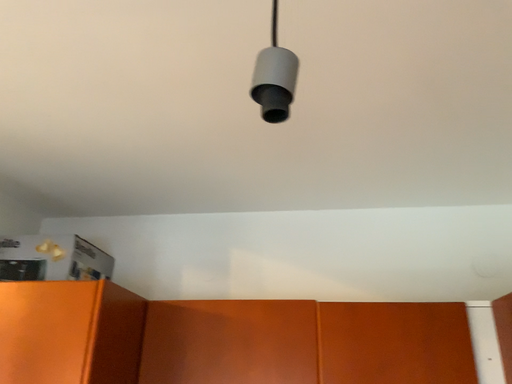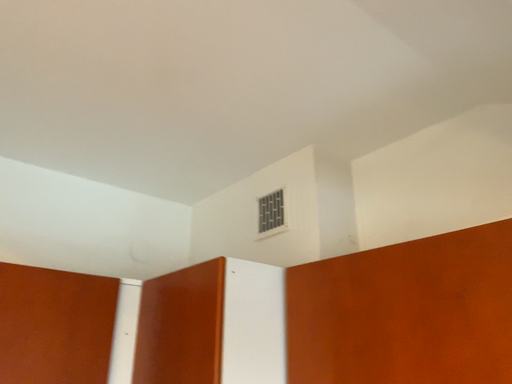
Question: How did the camera likely rotate when shooting the video?

Choices:
 (A) rotated right
 (B) rotated left

Answer: (A)